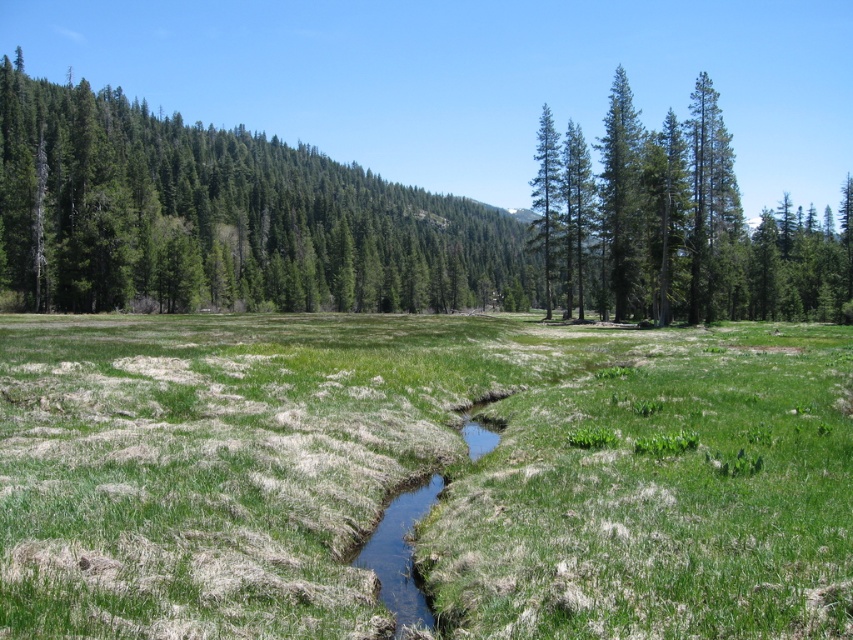
Question: Which of the following is the farthest from the observer?

Choices:
 (A) green matte tree at center
 (B) green matte tree at left
 (C) clear water stream at center

Answer: (A)

Question: Which object appears closest to the camera in this image?

Choices:
 (A) clear water stream at center
 (B) green matte tree at center

Answer: (A)

Question: Can you confirm if clear water stream at center is positioned below green matte tree at center?

Choices:
 (A) no
 (B) yes

Answer: (B)

Question: Is green matte tree at upper right smaller than clear water stream at center?

Choices:
 (A) no
 (B) yes

Answer: (A)

Question: In this image, where is green grass at center located relative to clear water stream at center?

Choices:
 (A) below
 (B) above

Answer: (B)

Question: Which point is closer to the camera?

Choices:
 (A) coord(703,470)
 (B) coord(10,77)

Answer: (A)